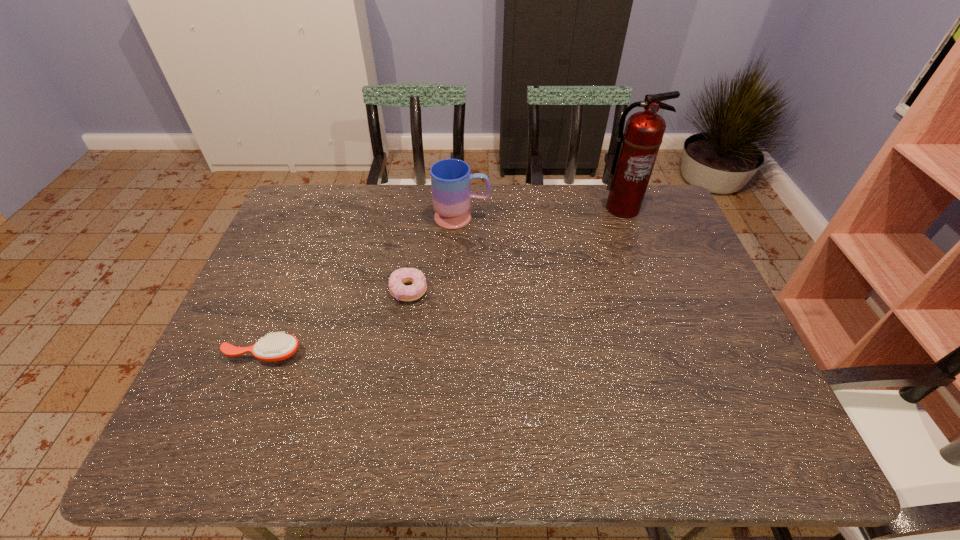
The height and width of the screenshot is (540, 960). In order to click on vacant space at the far right corner in this screenshot , I will do `click(660, 202)`.

In order to click on blank space at the near right corner of the desktop in this screenshot , I will do `click(760, 455)`.

The height and width of the screenshot is (540, 960). What are the coordinates of `vacant point located between the second nearest object and the tallest object` in the screenshot? It's located at (516, 249).

I want to click on free space that is in between the mug and the doughnut, so click(x=436, y=254).

Where is `vacant area that lies between the hairbrush and the rightmost object`? vacant area that lies between the hairbrush and the rightmost object is located at coordinates (443, 281).

Locate an element on the screen. vacant area between the leftmost object and the second nearest object is located at coordinates (336, 322).

Find the location of a particular element. free area in between the third farthest object and the second tallest object is located at coordinates (x=436, y=254).

Identify the location of free point between the third farthest object and the second tallest object. (436, 254).

Identify the location of unoccupied position between the doughnut and the rightmost object. This screenshot has width=960, height=540. (516, 249).

Image resolution: width=960 pixels, height=540 pixels. I want to click on vacant area that lies between the fire extinguisher and the nearest object, so click(x=443, y=281).